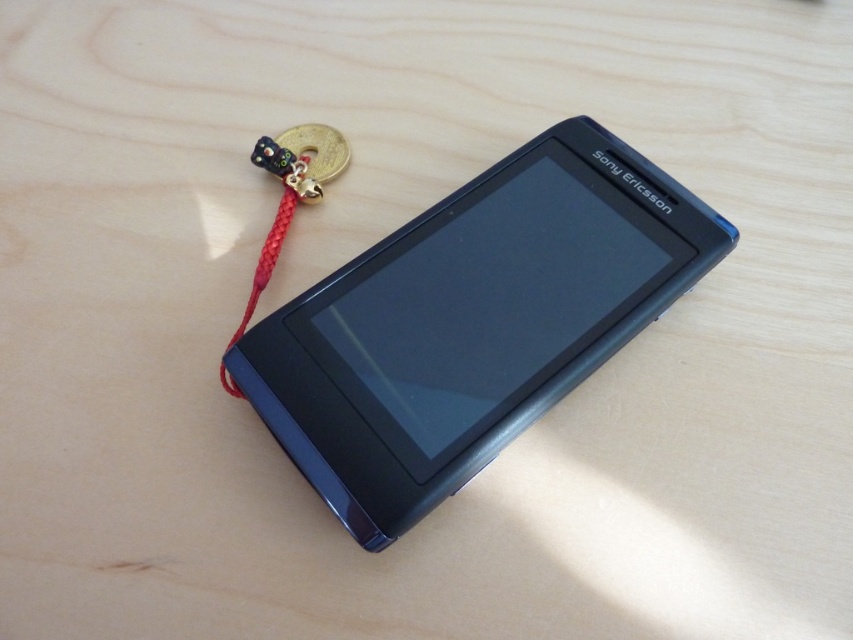
Question: Among these objects, which one is farthest from the camera?

Choices:
 (A) slate gray plastic smartphone at center
 (B) red braided string at bottom left

Answer: (B)

Question: Which point is farther to the camera?

Choices:
 (A) red braided string at bottom left
 (B) slate gray plastic smartphone at center

Answer: (A)

Question: Can you confirm if slate gray plastic smartphone at center is thinner than red braided string at bottom left?

Choices:
 (A) yes
 (B) no

Answer: (B)

Question: Which point is farther from the camera taking this photo?

Choices:
 (A) (267, 403)
 (B) (259, 262)

Answer: (B)

Question: Is slate gray plastic smartphone at center to the right of red braided string at bottom left from the viewer's perspective?

Choices:
 (A) yes
 (B) no

Answer: (A)

Question: Does slate gray plastic smartphone at center have a smaller size compared to red braided string at bottom left?

Choices:
 (A) no
 (B) yes

Answer: (A)